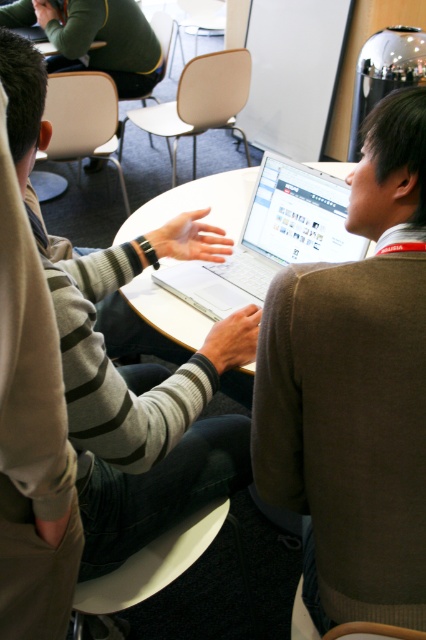
Is silver metallic laptop at center bigger than metallic silver chair at upper center?

Actually, silver metallic laptop at center might be smaller than metallic silver chair at upper center.

Is silver metallic laptop at center above metallic silver chair at upper center?

No, silver metallic laptop at center is not above metallic silver chair at upper center.

Is point (259, 200) positioned before point (198, 1)?

Yes, point (259, 200) is in front of point (198, 1).

At what (x,y) coordinates should I click in order to perform the action: click on silver metallic laptop at center. Please return your answer as a coordinate pair (x, y). Looking at the image, I should click on (271, 240).

Can you confirm if white plastic chair at lower center is positioned above white plastic chair at upper left?

No.

Which is in front, point (203, 547) or point (60, 84)?

Point (203, 547) is more forward.

Which is behind, point (180, 529) or point (85, 72)?

Point (85, 72)

This screenshot has height=640, width=426. What are the coordinates of `white plastic chair at lower center` in the screenshot? It's located at (152, 564).

What do you see at coordinates (201, 100) in the screenshot? I see `beige plastic chair at upper center` at bounding box center [201, 100].

You are a GUI agent. You are given a task and a screenshot of the screen. Output one action in this format:
    pyautogui.click(x=<x>, y=<y>)
    Task: Click on the beige plastic chair at upper center
    The image size is (426, 640).
    Given the screenshot: What is the action you would take?
    pyautogui.click(x=201, y=100)